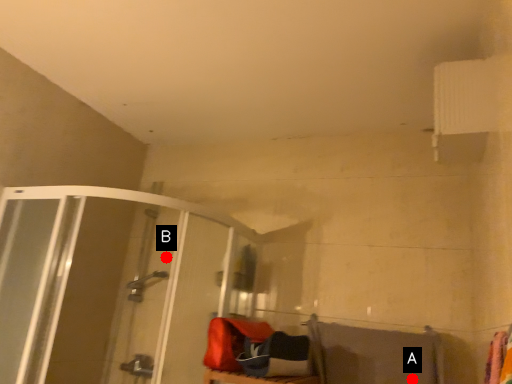
Question: Two points are circled on the image, labeled by A and B beside each circle. Among these points, which one is farthest from the camera?

Choices:
 (A) A is further
 (B) B is further

Answer: (B)